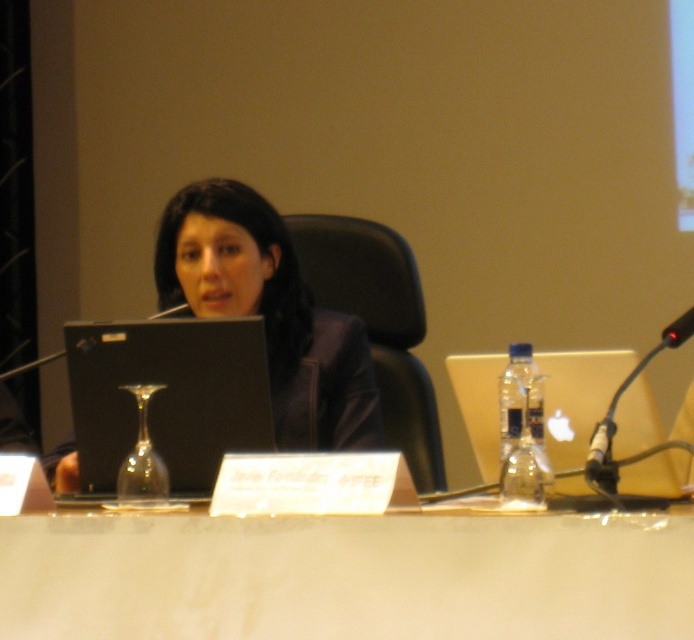
Question: Does matte black laptop at center have a larger size compared to black plastic microphone at right?

Choices:
 (A) yes
 (B) no

Answer: (A)

Question: Does matte black laptop at center appear over satin silver laptop at right?

Choices:
 (A) yes
 (B) no

Answer: (A)

Question: Does white glossy table at center have a smaller size compared to black matte laptop at center?

Choices:
 (A) yes
 (B) no

Answer: (B)

Question: Which point appears farthest from the camera in this image?

Choices:
 (A) (566, 392)
 (B) (198, 486)
 (C) (613, 490)
 (D) (348, 355)

Answer: (D)

Question: Which point is closer to the camera?

Choices:
 (A) (178, 323)
 (B) (228, 189)

Answer: (A)

Question: Which point is farther to the camera?

Choices:
 (A) black plastic microphone at right
 (B) satin silver laptop at right
 (C) white glossy table at center

Answer: (B)